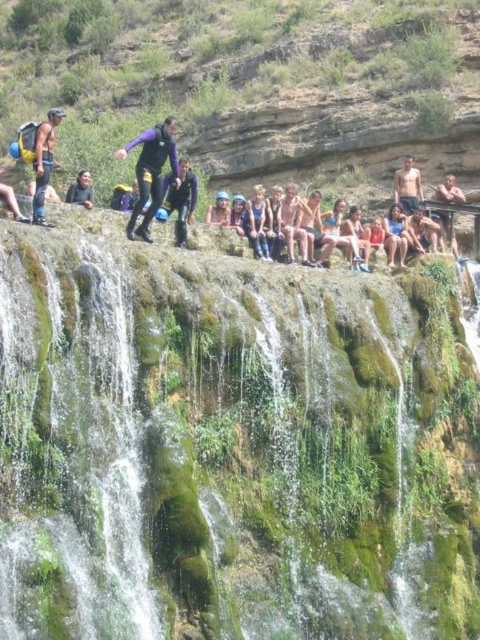
You are a photographer trying to capture a clear shot of both the matte black wetsuit at left and the matte black wetsuit at center. Since both are in the same area, which one is more likely to be in focus if you focus on the one closer to you?

The matte black wetsuit at left is positioned over the matte black wetsuit at center, meaning it is closer to you. If you focus on the one closer, the matte black wetsuit at left will be in focus while the matte black wetsuit at center may be slightly out of focus.

You are a photographer planning to take a photo of the purple matte wetsuit at center and the matte black wetsuit at left. Since you want both to be clearly visible in the frame, which wetsuit should you focus on first to ensure proper focus, considering their heights?

The purple matte wetsuit at center has a lesser height compared to the matte black wetsuit at left. Therefore, you should focus on the purple matte wetsuit at center first, as it is smaller in size and might require closer attention to capture details clearly.